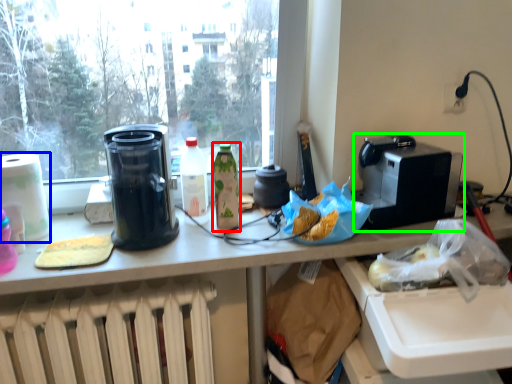
Question: Which object is positioned closest to bottle (highlighted by a red box)? Select from toilet paper (highlighted by a blue box) and kitchen appliance (highlighted by a green box).

Choices:
 (A) toilet paper
 (B) kitchen appliance

Answer: (B)